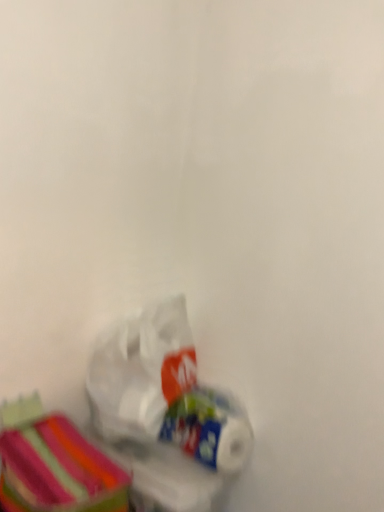
Question: Considering the positions of striped fabric storage box at lower left and white glossy toilet paper at lower center in the image, is striped fabric storage box at lower left taller or shorter than white glossy toilet paper at lower center?

Choices:
 (A) tall
 (B) short

Answer: (A)

Question: From a real-world perspective, is striped fabric storage box at lower left above or below white glossy toilet paper at lower center?

Choices:
 (A) above
 (B) below

Answer: (B)

Question: Estimate the real-world distances between objects in this image. Which object is farther from the white glossy toilet paper at lower center?

Choices:
 (A) translucent plastic bag at lower left
 (B) striped fabric storage box at lower left

Answer: (B)

Question: Estimate the real-world distances between objects in this image. Which object is closer to the striped fabric storage box at lower left?

Choices:
 (A) white glossy toilet paper at lower center
 (B) translucent plastic bag at lower left

Answer: (B)